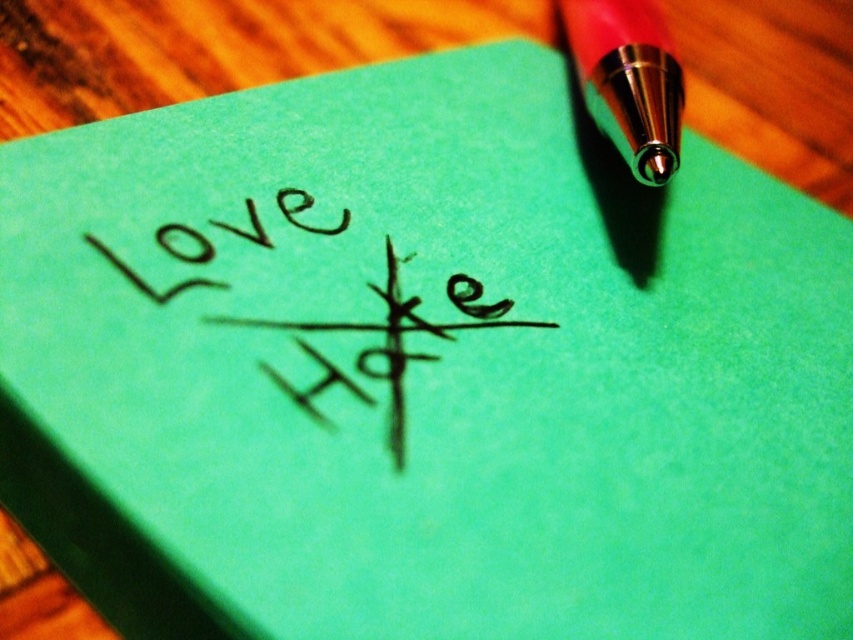
Is point (292, 396) more distant than point (679, 109)?

No, (292, 396) is closer to viewer.

Is point (482, 317) closer to viewer compared to point (634, 108)?

Yes, it is.

Is point (296, 342) more distant than point (604, 38)?

No, (296, 342) is closer to viewer.

Where is `black ink writing at center`? black ink writing at center is located at coordinates (399, 333).

Which of these two, black ink writing at center or matte black writing at upper left, stands shorter?

matte black writing at upper left

Does black ink writing at center have a lesser width compared to matte black writing at upper left?

Incorrect, black ink writing at center's width is not less than matte black writing at upper left's.

You are a GUI agent. You are given a task and a screenshot of the screen. Output one action in this format:
    pyautogui.click(x=<x>, y=<y>)
    Task: Click on the black ink writing at center
    
    Given the screenshot: What is the action you would take?
    pyautogui.click(x=399, y=333)

Is red metallic pen tip at upper right further to camera compared to matte black writing at upper left?

That is True.

Between point (602, 72) and point (335, 228), which one is positioned in front?

Point (335, 228) is more forward.

Is point (657, 140) closer to camera compared to point (134, 280)?

No, (657, 140) is behind (134, 280).

Where is `red metallic pen tip at upper right`? The image size is (853, 640). red metallic pen tip at upper right is located at coordinates pyautogui.click(x=628, y=81).